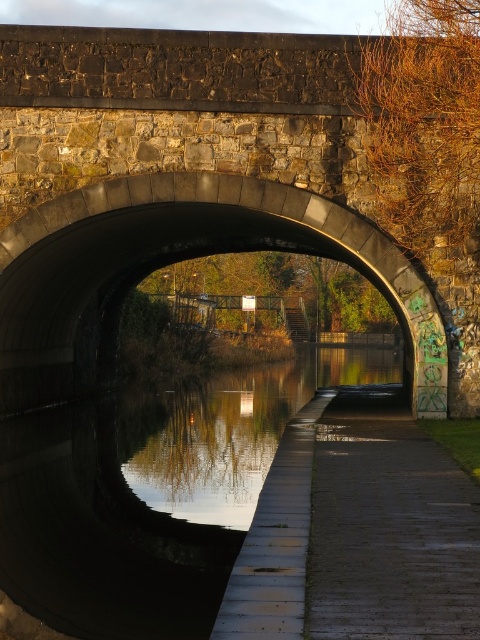
Question: Where is smooth concrete bridge at center located in relation to dark gray concrete path at center in the image?

Choices:
 (A) below
 (B) above

Answer: (B)

Question: Where is dark reflective water at center located in relation to smooth concrete bridge at center in the image?

Choices:
 (A) right
 (B) left

Answer: (B)

Question: Considering the relative positions of dark reflective water at center and dark gray concrete path at center in the image provided, where is dark reflective water at center located with respect to dark gray concrete path at center?

Choices:
 (A) above
 (B) below

Answer: (B)

Question: Estimate the real-world distances between objects in this image. Which object is farther from the dark reflective water at center?

Choices:
 (A) smooth concrete bridge at center
 (B) dark gray concrete path at center

Answer: (B)

Question: Which object is positioned farthest from the dark reflective water at center?

Choices:
 (A) dark gray concrete path at center
 (B) smooth concrete bridge at center

Answer: (A)

Question: Among these objects, which one is farthest from the camera?

Choices:
 (A) dark reflective water at center
 (B) smooth concrete bridge at center

Answer: (B)